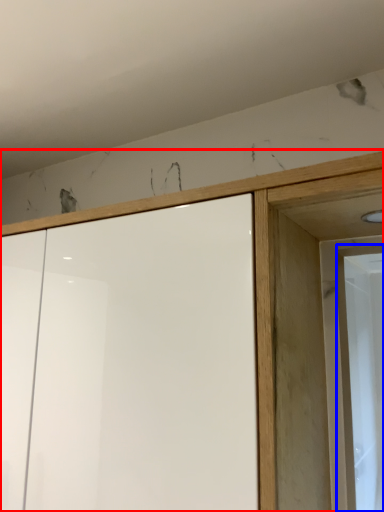
Question: Which point is further to the camera, cupboard (highlighted by a red box) or screen door (highlighted by a blue box)?

Choices:
 (A) cupboard
 (B) screen door

Answer: (B)